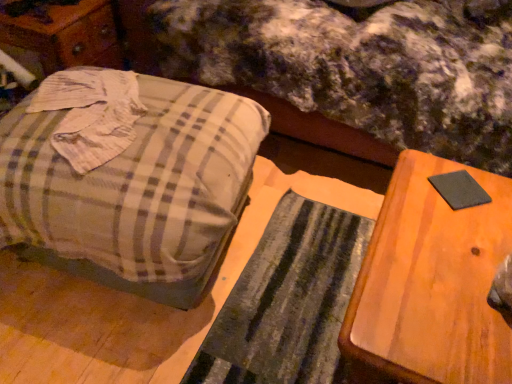
Where is `empty space that is ontop of plaid fabric suitcase at left`? The image size is (512, 384). empty space that is ontop of plaid fabric suitcase at left is located at coordinates (92, 116).